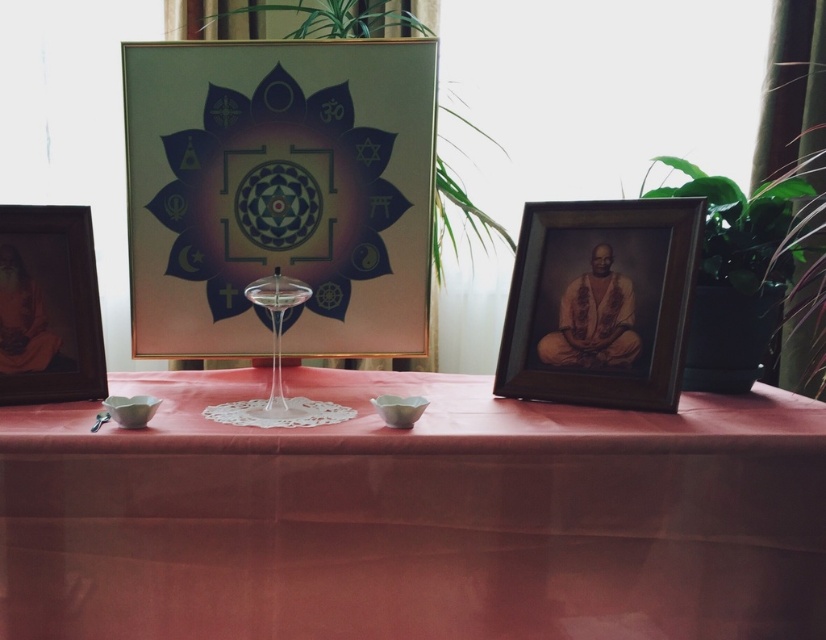
You are arranging flowers for a centerpiece and need to know which object is taller between the matte wooden picture frame at left and the green leafy plant at upper center. Based on the scene, which one is taller?

The green leafy plant at upper center is taller than the matte wooden picture frame at left.

You are arranging items on a table and want to ensure that the transparent glass wine glass at center is visible. Since the matte wooden picture frame at left is blocking its view, how should you adjust their positions?

To make the transparent glass wine glass at center visible, move the matte wooden picture frame at left to the side so it no longer blocks the glass. The transparent glass wine glass at center is currently positioned behind the matte wooden picture frame at left, so repositioning the frame will allow the glass to be seen.

You are standing at the edge of the table and want to place a small vase on the table. The vase is 10 cm in diameter. There is an empty space between the central framed artwork and the matte wooden picture frame at left. Can the vase fit in that space?

The space between the central framed artwork and the matte wooden picture frame at left is not specified in the provided information. Therefore, it is uncertain whether the vase will fit there.